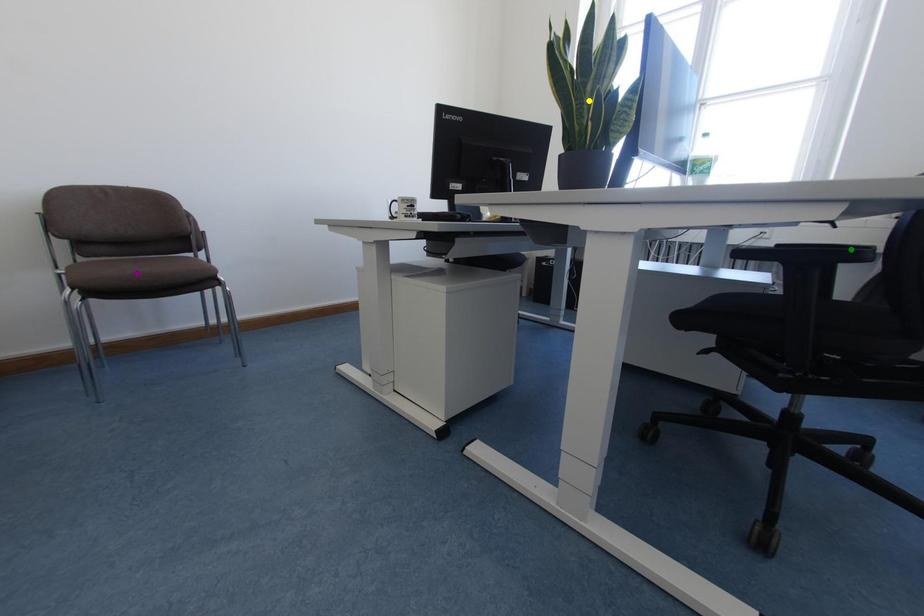
Order these from farthest to nearest:
1. yellow point
2. green point
3. purple point

purple point < green point < yellow point